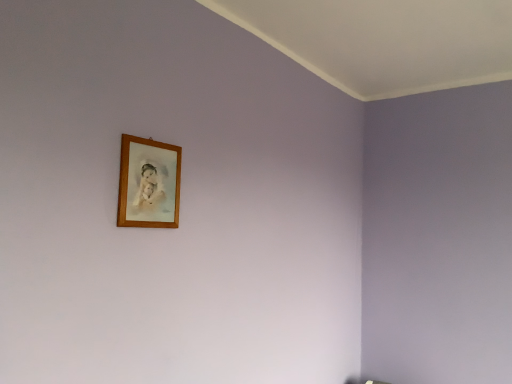
This screenshot has width=512, height=384. What do you see at coordinates (149, 183) in the screenshot? I see `wooden picture frame at upper center` at bounding box center [149, 183].

Locate an element on the screen. The image size is (512, 384). wooden picture frame at upper center is located at coordinates (149, 183).

Find the location of a particular element. The height and width of the screenshot is (384, 512). wooden picture frame at upper center is located at coordinates click(x=149, y=183).